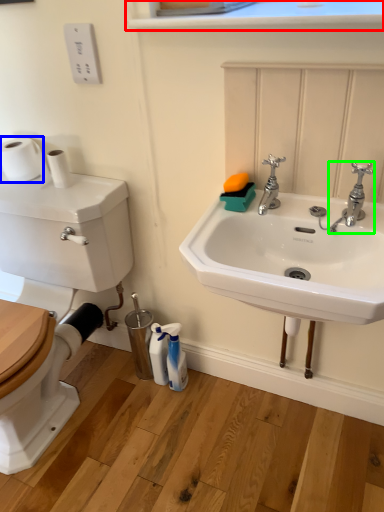
Question: Which object is the farthest from window sill (highlighted by a red box)? Choose among these: toilet paper (highlighted by a blue box) or tap (highlighted by a green box).

Choices:
 (A) toilet paper
 (B) tap

Answer: (A)